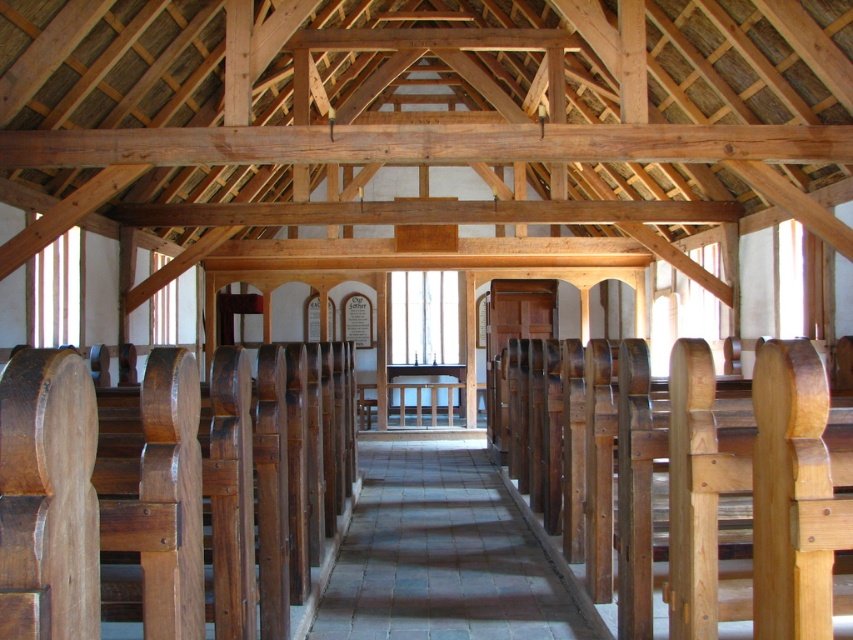
Question: Can you confirm if natural wood church bench at center is smaller than gray stone aisle at center?

Choices:
 (A) no
 (B) yes

Answer: (A)

Question: Can you confirm if natural wood church bench at center is bigger than gray stone aisle at center?

Choices:
 (A) yes
 (B) no

Answer: (A)

Question: Which of the following is the farthest from the observer?

Choices:
 (A) natural wood church bench at center
 (B) gray stone aisle at center

Answer: (B)

Question: Is natural wood church bench at center below gray stone aisle at center?

Choices:
 (A) no
 (B) yes

Answer: (A)

Question: Among these points, which one is farthest from the camera?

Choices:
 (A) (724, 460)
 (B) (367, 509)

Answer: (B)